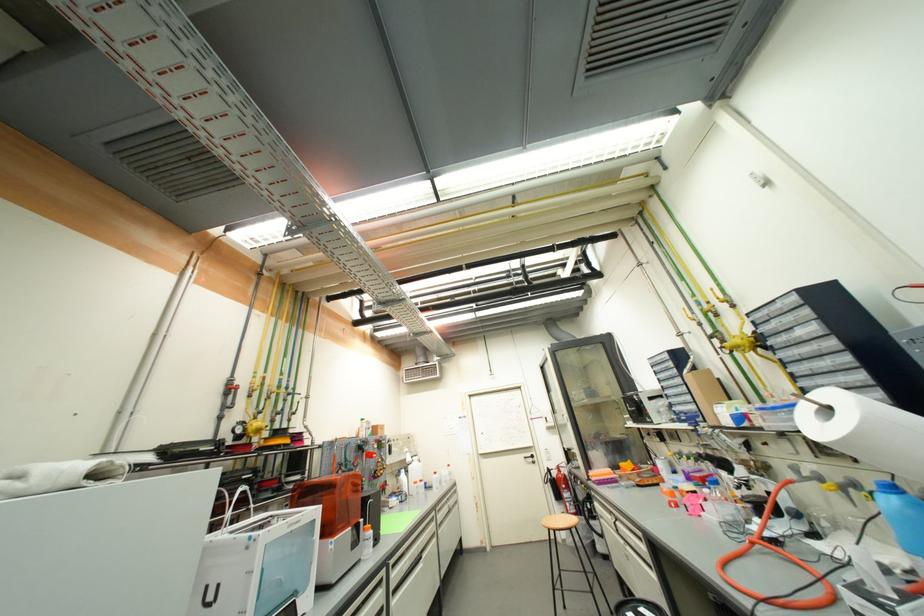
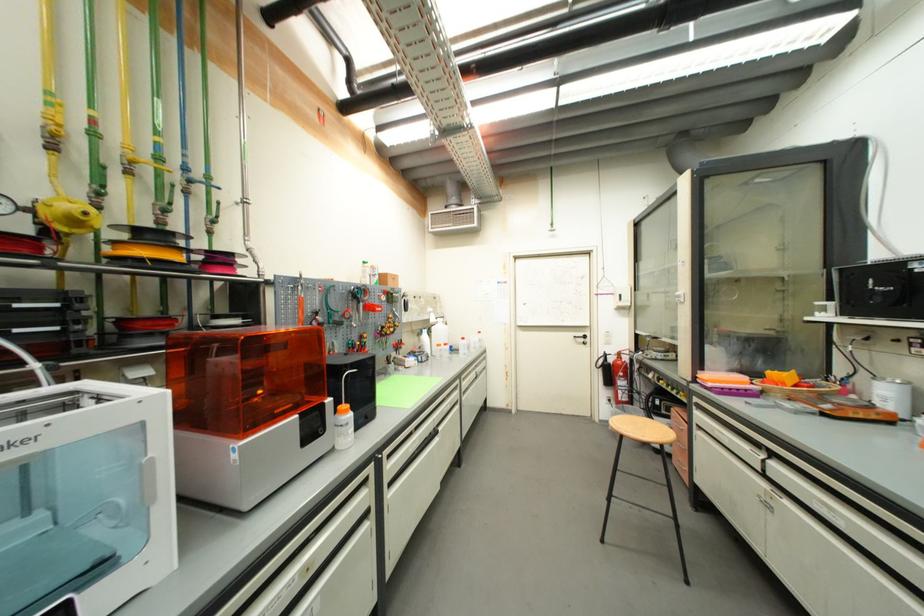
Where in the second image is the point corresponding to point (568, 488) from the first image?

(626, 376)